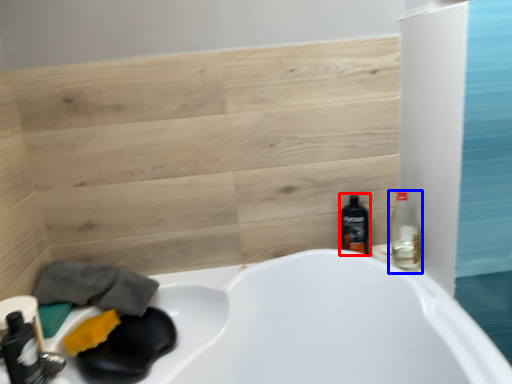
Question: Which object is closer to the camera taking this photo, bottle (highlighted by a red box) or bottle (highlighted by a blue box)?

Choices:
 (A) bottle
 (B) bottle

Answer: (B)